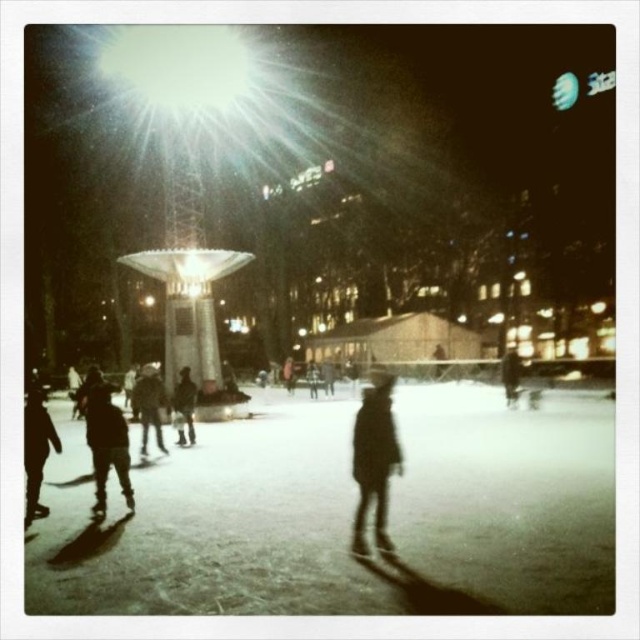
Question: Which of the following is the closest to the observer?

Choices:
 (A) (108, 465)
 (B) (508, 360)
 (C) (60, 449)
 (D) (179, 388)

Answer: (C)

Question: Where is white matte snow at center located in relation to dark brown leather jacket at center in the image?

Choices:
 (A) left
 (B) right

Answer: (A)

Question: Does dark brown leather jacket at lower left appear on the left side of dark woolen hat at center?

Choices:
 (A) yes
 (B) no

Answer: (B)

Question: Which object appears farthest from the camera in this image?

Choices:
 (A) dark fabric jacket at center
 (B) dark matte clothing at lower left
 (C) white matte snow at center

Answer: (A)

Question: Which point appears closest to the camera in this image?

Choices:
 (A) (358, 476)
 (B) (445, 573)

Answer: (B)

Question: In this image, where is dark fabric jacket at center located relative to dark brown leather jacket at center?

Choices:
 (A) right
 (B) left

Answer: (B)